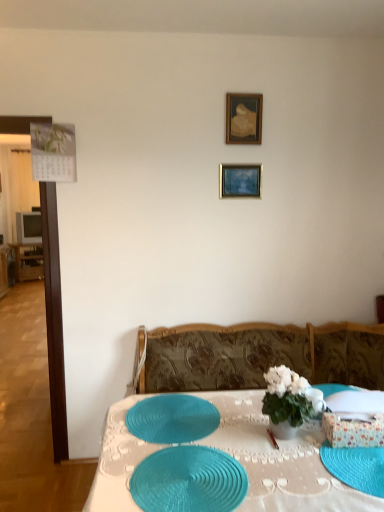
Question: Does blue textured glass plate at lower right have a larger size compared to teal woven placemat at center, the 1th tableware viewed from the back?

Choices:
 (A) yes
 (B) no

Answer: (B)

Question: Could you tell me if blue textured glass plate at lower right is facing teal woven placemat at center, which ranks as the 2th tableware in front-to-back order?

Choices:
 (A) yes
 (B) no

Answer: (A)

Question: Considering the relative positions of blue textured glass plate at lower right and teal woven placemat at center, which ranks as the 2th tableware in front-to-back order, in the image provided, is blue textured glass plate at lower right to the left of teal woven placemat at center, which ranks as the 2th tableware in front-to-back order, from the viewer's perspective?

Choices:
 (A) no
 (B) yes

Answer: (A)

Question: Are blue textured glass plate at lower right and teal woven placemat at center, which ranks as the 2th tableware in front-to-back order, beside each other?

Choices:
 (A) yes
 (B) no

Answer: (B)

Question: Is blue textured glass plate at lower right located outside teal woven placemat at center, the 1th tableware viewed from the back?

Choices:
 (A) no
 (B) yes

Answer: (B)

Question: From the image's perspective, does blue textured glass plate at lower right appear higher than teal woven placemat at center, which ranks as the 2th tableware in front-to-back order?

Choices:
 (A) yes
 (B) no

Answer: (B)

Question: Considering the relative positions of white glossy vase at center and teal woven placemat at center, positioned as the second tableware in back-to-front order, in the image provided, is white glossy vase at center to the right of teal woven placemat at center, positioned as the second tableware in back-to-front order, from the viewer's perspective?

Choices:
 (A) no
 (B) yes

Answer: (B)

Question: Does white glossy vase at center appear on the left side of teal woven placemat at center, positioned as the second tableware in back-to-front order?

Choices:
 (A) yes
 (B) no

Answer: (B)

Question: Would you say white glossy vase at center is a long distance from teal woven placemat at center, the first tableware in the front-to-back sequence?

Choices:
 (A) no
 (B) yes

Answer: (A)

Question: Is white glossy vase at center thinner than teal woven placemat at center, positioned as the second tableware in back-to-front order?

Choices:
 (A) no
 (B) yes

Answer: (B)

Question: From the image's perspective, would you say white glossy vase at center is shown under teal woven placemat at center, positioned as the second tableware in back-to-front order?

Choices:
 (A) no
 (B) yes

Answer: (A)

Question: From the image's perspective, is white glossy vase at center located above teal woven placemat at center, the first tableware in the front-to-back sequence?

Choices:
 (A) no
 (B) yes

Answer: (B)

Question: Can you confirm if teal woven placemat at center, the first tableware in the front-to-back sequence, is bigger than gold metallic picture frame at upper center, acting as the first picture frame starting from the bottom?

Choices:
 (A) yes
 (B) no

Answer: (A)